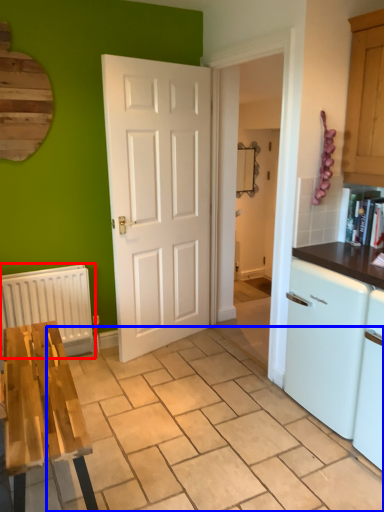
Question: Which object is further to the camera taking this photo, radiator (highlighted by a red box) or tile (highlighted by a blue box)?

Choices:
 (A) radiator
 (B) tile

Answer: (A)